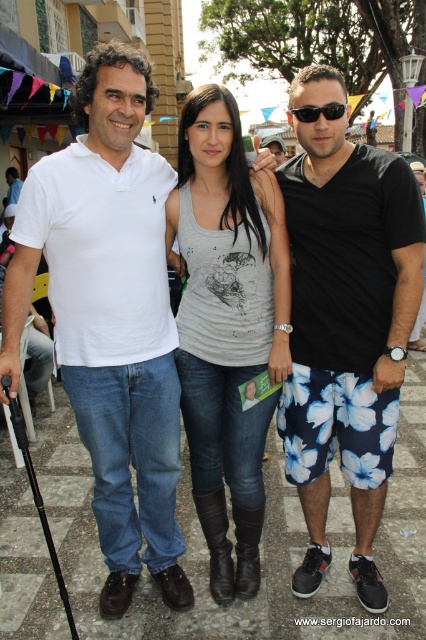
Question: Does white cotton polo shirt at center have a larger size compared to matte white polo shirt at left?

Choices:
 (A) no
 (B) yes

Answer: (B)

Question: Which of the following is the farthest from the observer?

Choices:
 (A) black cotton shorts at right
 (B) white cotton polo shirt at center
 (C) matte white polo shirt at left

Answer: (C)

Question: Can you confirm if gray cotton tank top at center is positioned to the left of black plastic sunglasses at center?

Choices:
 (A) no
 (B) yes

Answer: (B)

Question: Does white cotton polo shirt at center lie in front of gray cotton tank top at center?

Choices:
 (A) yes
 (B) no

Answer: (A)

Question: Which point appears closest to the camera in this image?

Choices:
 (A) (14, 180)
 (B) (11, 369)
 (C) (314, 388)
 (D) (322, 113)

Answer: (B)

Question: Which of these objects is positioned farthest from the white cotton polo shirt at center?

Choices:
 (A) gray cotton tank top at center
 (B) black cotton shorts at right
 (C) matte white polo shirt at left

Answer: (C)